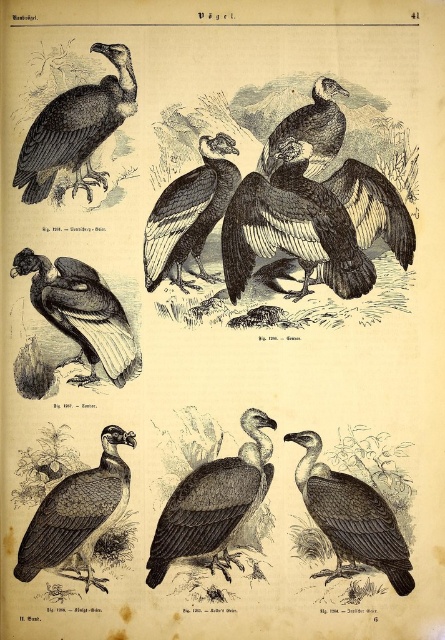
You are examining a vulture illustration in a natural history book. You notice two points labeled as point 1 at coordinates point (291,212) and point 2 at coordinates point (327,104). Which point is positioned closer to your viewpoint?

Point (291,212) is closer to the viewer than point (327,104).